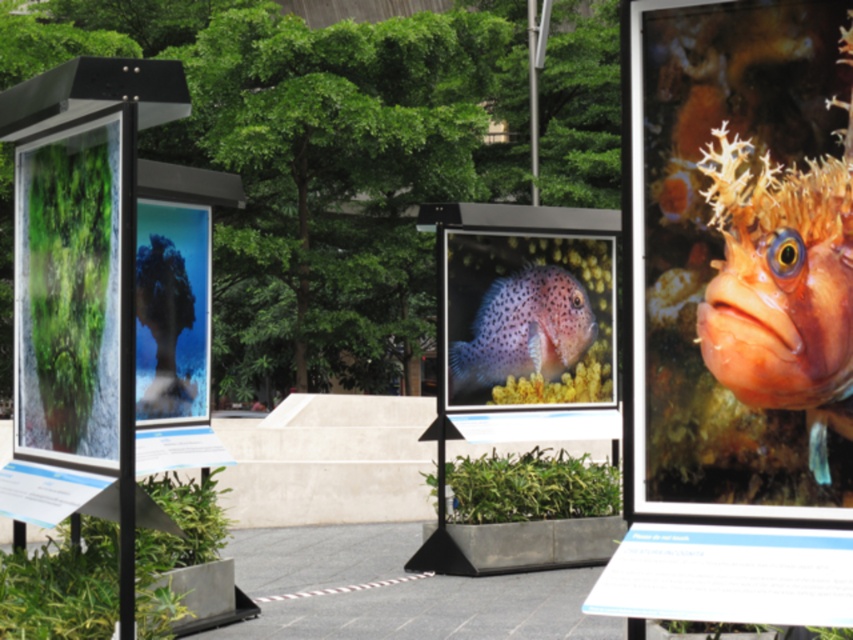
You are standing at the center of the paved area surrounded by greenery where the marine life photographs are displayed. There are two points marked on the ground at coordinates point (514, 225) and point (30, 314). If you want to walk towards the point that is closer to you, which one should you choose?

Point (30, 314) is closer to you because point (514, 225) is behind it.

You are an art curator planning to hang the orange textured fish at right and the green matte poster at left on a wall. If the wall has limited horizontal space, which object should you choose to fit better in a narrow area?

The orange textured fish at right is thinner than the green matte poster at left, so it would fit better in a narrow area.

You are standing 10 feet away from the outdoor display of marine life photographs. There is a specific point marked at coordinates point (x=785, y=440). Can you reach this point without moving closer than your current distance?

The distance of point (x=785, y=440) from viewer is 13.19 feet, which is farther than your current 10 feet distance. Therefore, you cannot reach the point without moving closer.